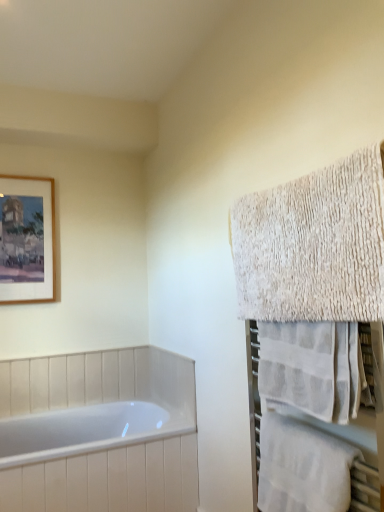
Question: Does white textured towel at right, the 1th towel positioned from the bottom, have a lesser height compared to white glossy bathtub at lower left?

Choices:
 (A) yes
 (B) no

Answer: (A)

Question: Can you confirm if white textured towel at right, the 1th towel positioned from the bottom, is bigger than white glossy bathtub at lower left?

Choices:
 (A) yes
 (B) no

Answer: (B)

Question: From the image's perspective, is white textured towel at right, the 1th towel positioned from the bottom, above white glossy bathtub at lower left?

Choices:
 (A) yes
 (B) no

Answer: (A)

Question: Is white glossy bathtub at lower left at the back of white textured towel at right, the 1th towel positioned from the bottom?

Choices:
 (A) yes
 (B) no

Answer: (B)

Question: Would you consider white textured towel at right, which is the 3th towel from top to bottom, to be distant from white glossy bathtub at lower left?

Choices:
 (A) yes
 (B) no

Answer: (A)

Question: Is the depth of white textured towel at right, which is the 3th towel from top to bottom, greater than that of white glossy bathtub at lower left?

Choices:
 (A) no
 (B) yes

Answer: (A)

Question: Is wooden-framed painting at upper left not near white glossy bathtub at lower left?

Choices:
 (A) yes
 (B) no

Answer: (B)

Question: Does wooden-framed painting at upper left have a greater height compared to white glossy bathtub at lower left?

Choices:
 (A) no
 (B) yes

Answer: (B)

Question: Is wooden-framed painting at upper left next to white glossy bathtub at lower left?

Choices:
 (A) yes
 (B) no

Answer: (B)

Question: Is wooden-framed painting at upper left bigger than white glossy bathtub at lower left?

Choices:
 (A) yes
 (B) no

Answer: (B)

Question: Is white glossy bathtub at lower left surrounded by wooden-framed painting at upper left?

Choices:
 (A) no
 (B) yes

Answer: (A)

Question: Considering the relative sizes of wooden-framed painting at upper left and white glossy bathtub at lower left in the image provided, is wooden-framed painting at upper left wider than white glossy bathtub at lower left?

Choices:
 (A) yes
 (B) no

Answer: (B)

Question: Would you say wooden-framed painting at upper left contains white textured towel at right, positioned as the first towel in top-to-bottom order?

Choices:
 (A) yes
 (B) no

Answer: (B)